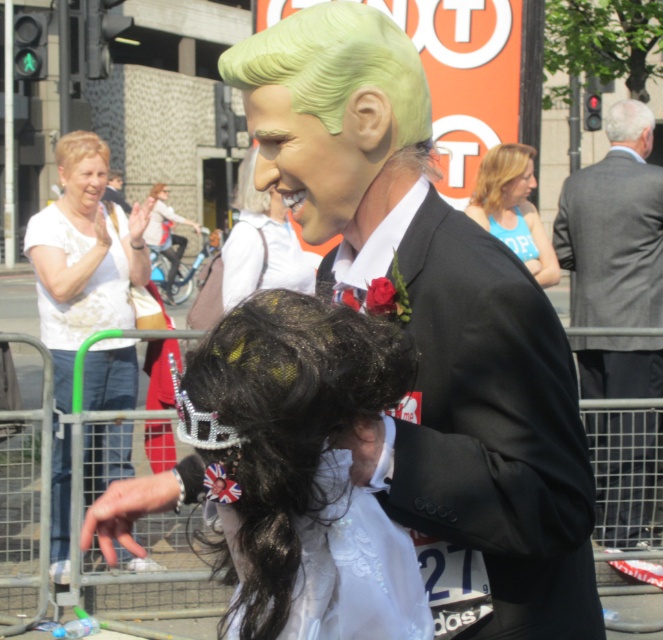
You are a photographer trying to capture a candid shot of the two wigs in the scene. The camera you are using has a maximum focus range of 2 meters. Can you frame both the blonde synthetic wig at upper left and the smooth blonde wig at center in the same shot without moving the camera?

The distance between the blonde synthetic wig at upper left and the smooth blonde wig at center is 2.15 meters, which exceeds the camera maximum focus range of 2 meters. Therefore, you cannot frame both wigs in the same shot without moving the camera.